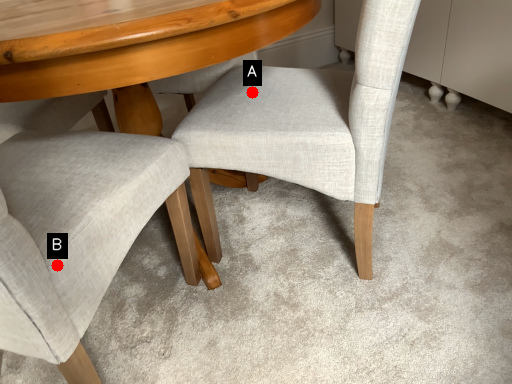
Question: Two points are circled on the image, labeled by A and B beside each circle. Which point is further to the camera?

Choices:
 (A) A is further
 (B) B is further

Answer: (A)